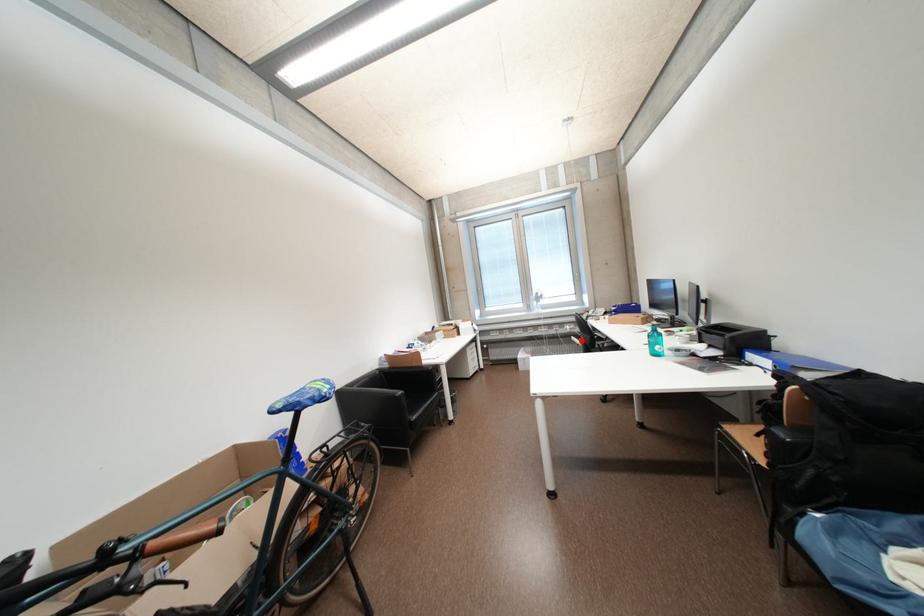
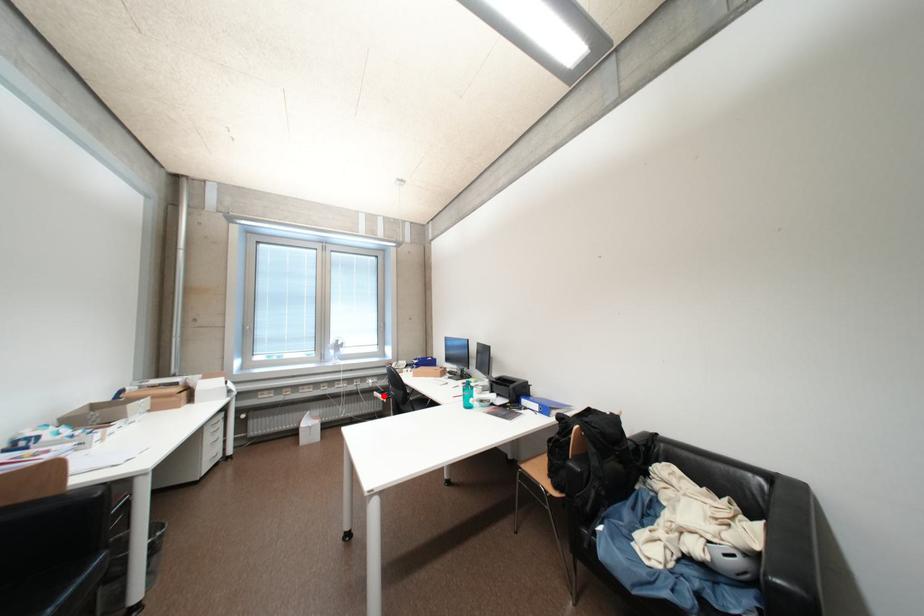
In the scene shown: I am providing you with two images of the same scene from different viewpoints. A red point is marked on the first image and another point is marked on the second image. Is the red point in image1 aligned with the point shown in image2?

Yes